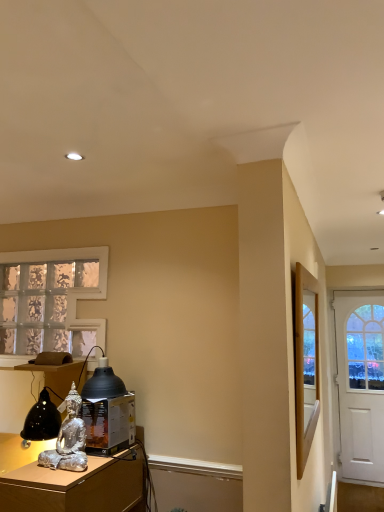
Question: Is white matte door at right outside of matte black lampshade at lower left?

Choices:
 (A) yes
 (B) no

Answer: (A)

Question: Considering the relative sizes of white matte door at right and matte black lampshade at lower left in the image provided, is white matte door at right shorter than matte black lampshade at lower left?

Choices:
 (A) yes
 (B) no

Answer: (B)

Question: Considering the relative positions of white matte door at right and matte black lampshade at lower left in the image provided, is white matte door at right to the right of matte black lampshade at lower left from the viewer's perspective?

Choices:
 (A) yes
 (B) no

Answer: (A)

Question: From the image's perspective, is white matte door at right located above matte black lampshade at lower left?

Choices:
 (A) yes
 (B) no

Answer: (B)

Question: Can you confirm if white matte door at right is taller than matte black lampshade at lower left?

Choices:
 (A) yes
 (B) no

Answer: (A)

Question: In terms of size, does wooden framed mirror at right appear bigger or smaller than silver metallic statue at lower left?

Choices:
 (A) small
 (B) big

Answer: (A)

Question: From the image's perspective, is wooden framed mirror at right positioned above or below silver metallic statue at lower left?

Choices:
 (A) below
 (B) above

Answer: (B)

Question: Considering the positions of point (296, 400) and point (3, 507), is point (296, 400) closer or farther from the camera than point (3, 507)?

Choices:
 (A) farther
 (B) closer

Answer: (B)

Question: Do you think wooden framed mirror at right is within silver metallic statue at lower left, or outside of it?

Choices:
 (A) inside
 (B) outside

Answer: (B)

Question: Do you think silver metallic statue at lower left is within wooden framed mirror at right, or outside of it?

Choices:
 (A) outside
 (B) inside

Answer: (A)

Question: From the image's perspective, relative to wooden framed mirror at right, is silver metallic statue at lower left above or below?

Choices:
 (A) below
 (B) above

Answer: (A)

Question: From a real-world perspective, is silver metallic statue at lower left physically located above or below wooden framed mirror at right?

Choices:
 (A) above
 (B) below

Answer: (B)

Question: Considering the positions of silver metallic statue at lower left and wooden framed mirror at right in the image, is silver metallic statue at lower left bigger or smaller than wooden framed mirror at right?

Choices:
 (A) big
 (B) small

Answer: (A)

Question: From a real-world perspective, is white matte door at right positioned above or below silver metallic statue at lower left?

Choices:
 (A) above
 (B) below

Answer: (A)

Question: Is white matte door at right in front of or behind silver metallic statue at lower left in the image?

Choices:
 (A) behind
 (B) front

Answer: (A)